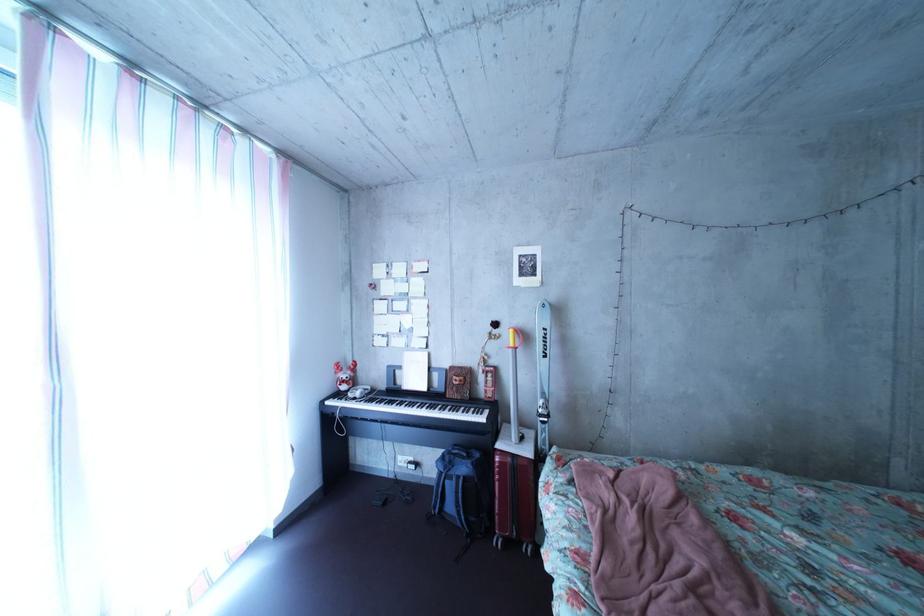
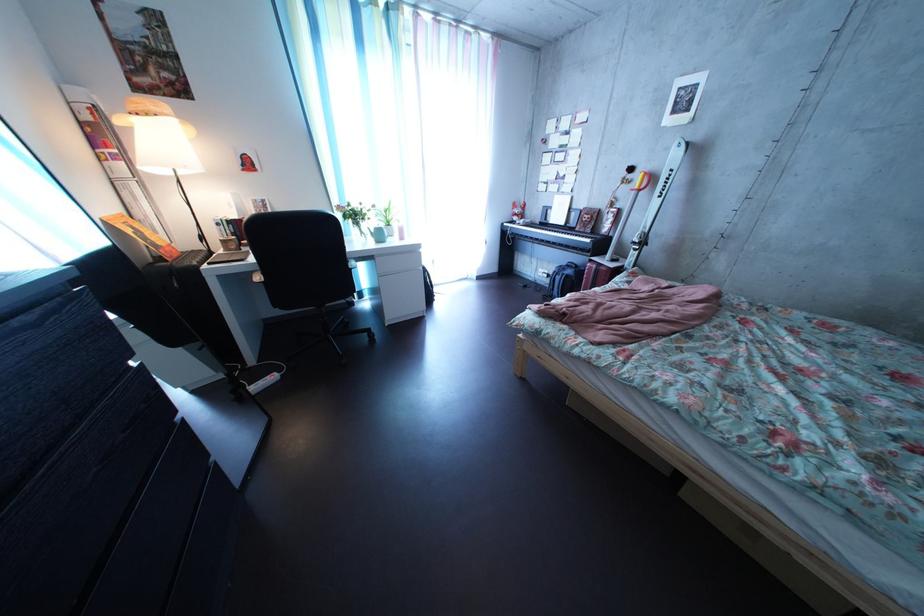
Where in the second image is the point corresponding to the point at 555,424 from the first image?

(648, 252)